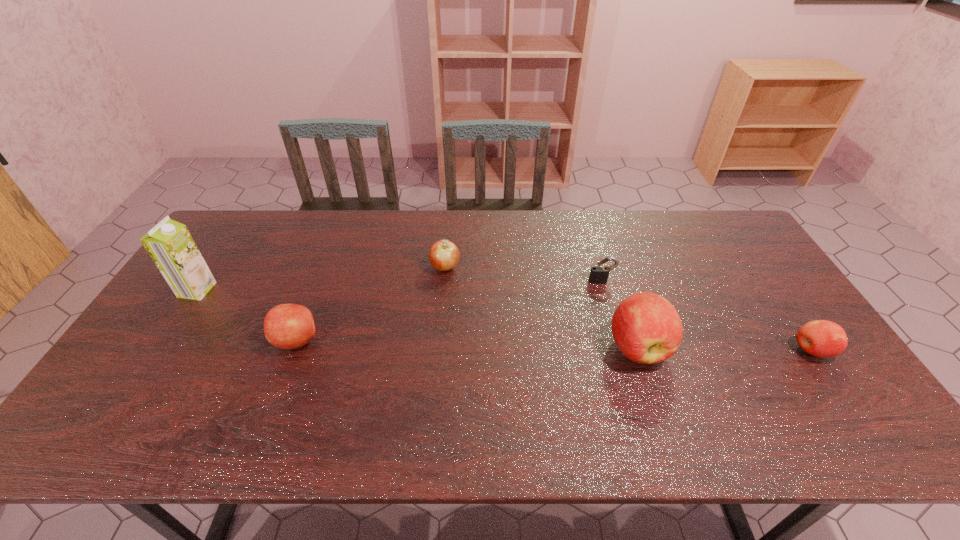
I want to click on the fifth object from right to left, so click(x=288, y=326).

Where is `the third shortest apple`? the third shortest apple is located at coordinates (288, 326).

Locate an element on the screen. the tallest apple is located at coordinates (647, 329).

The height and width of the screenshot is (540, 960). I want to click on the third apple from left to right, so click(647, 329).

Identify the location of the rightmost apple. This screenshot has width=960, height=540. (821, 338).

Where is `the tallest object`? This screenshot has width=960, height=540. the tallest object is located at coordinates (170, 245).

Locate an element on the screen. This screenshot has width=960, height=540. the leftmost object is located at coordinates (170, 245).

Find the location of a particular element. The height and width of the screenshot is (540, 960). the farthest object is located at coordinates (443, 255).

Find the location of a particular element. The width and height of the screenshot is (960, 540). the third object from left to right is located at coordinates (443, 255).

You are a GUI agent. You are given a task and a screenshot of the screen. Output one action in this format:
    pyautogui.click(x=<x>, y=<y>)
    Task: Click on the padlock
    Image resolution: width=960 pixels, height=540 pixels.
    Given the screenshot: What is the action you would take?
    pyautogui.click(x=599, y=274)